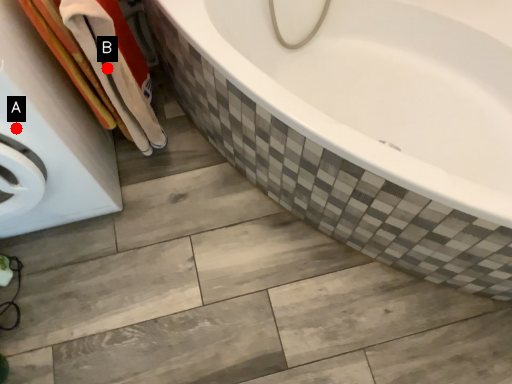
Question: Two points are circled on the image, labeled by A and B beside each circle. Among these points, which one is farthest from the camera?

Choices:
 (A) A is further
 (B) B is further

Answer: (B)